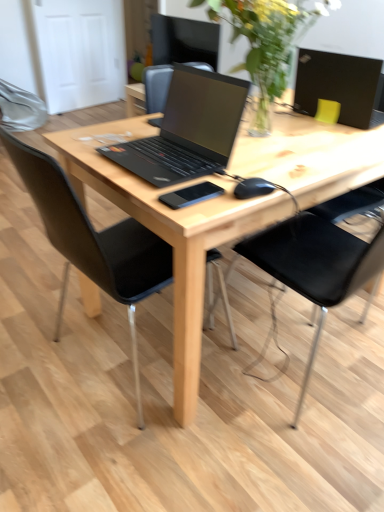
The height and width of the screenshot is (512, 384). Find the location of `free area in between black matte laptop at upper right, the second laptop from the front, and translucent glass vase at center`. free area in between black matte laptop at upper right, the second laptop from the front, and translucent glass vase at center is located at coordinates (306, 122).